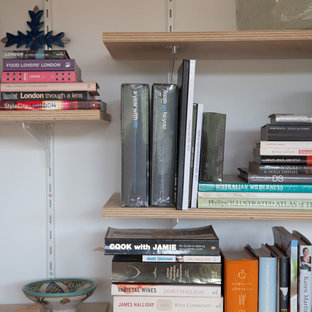
Where is `wood shelving`? wood shelving is located at coordinates (141, 39), (83, 115), (113, 212), (99, 305).